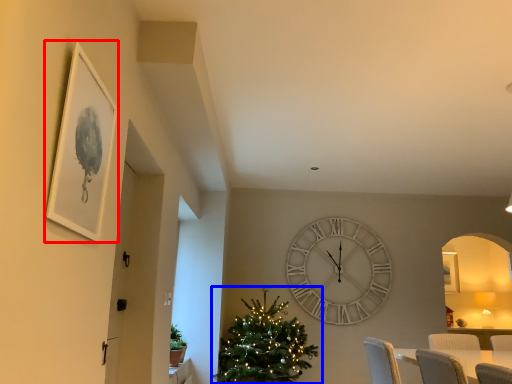
Question: Among these objects, which one is farthest to the camera, picture frame (highlighted by a red box) or christmas tree (highlighted by a blue box)?

Choices:
 (A) picture frame
 (B) christmas tree

Answer: (B)